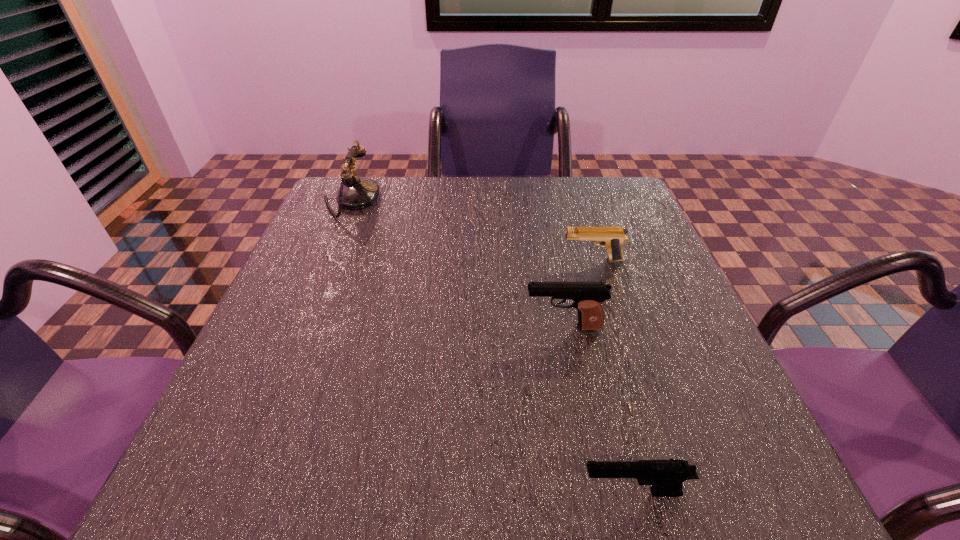
I want to click on free space between the nearest pistol and the farthest object, so click(x=492, y=346).

Where is `free point between the nearest object and the second farthest pistol`? The height and width of the screenshot is (540, 960). free point between the nearest object and the second farthest pistol is located at coordinates (598, 410).

Find the location of a particular element. This screenshot has width=960, height=540. vacant space that is in between the second nearest pistol and the leftmost object is located at coordinates (457, 264).

Where is `free area in between the nearest pistol and the third nearest object`? free area in between the nearest pistol and the third nearest object is located at coordinates (612, 376).

At what (x,y) coordinates should I click in order to perform the action: click on object that is the third closest to the leftmost object. Please return your answer as a coordinate pair (x, y). The height and width of the screenshot is (540, 960). Looking at the image, I should click on (666, 476).

At what (x,y) coordinates should I click in order to perform the action: click on object that stands as the second closest to the third nearest object. Please return your answer as a coordinate pair (x, y). Looking at the image, I should click on (356, 193).

Locate an element on the screen. Image resolution: width=960 pixels, height=540 pixels. pistol identified as the closest to the nearest object is located at coordinates (588, 297).

Point out which pistol is positioned as the second nearest to the tallest pistol. Please provide its 2D coordinates. Your answer should be formatted as a tuple, i.e. [(x, y)], where the tuple contains the x and y coordinates of a point satisfying the conditions above.

[(666, 476)]